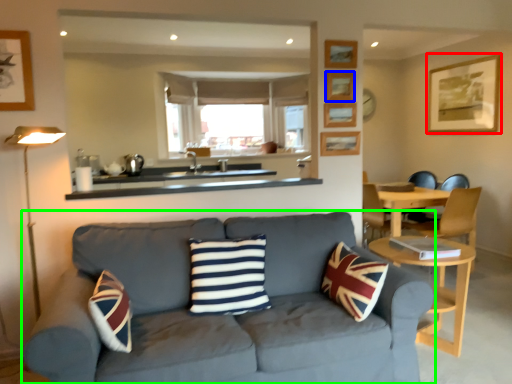
Question: Which object is positioned closest to picture frame (highlighted by a red box)? Select from picture frame (highlighted by a blue box) and studio couch (highlighted by a green box).

Choices:
 (A) picture frame
 (B) studio couch

Answer: (A)